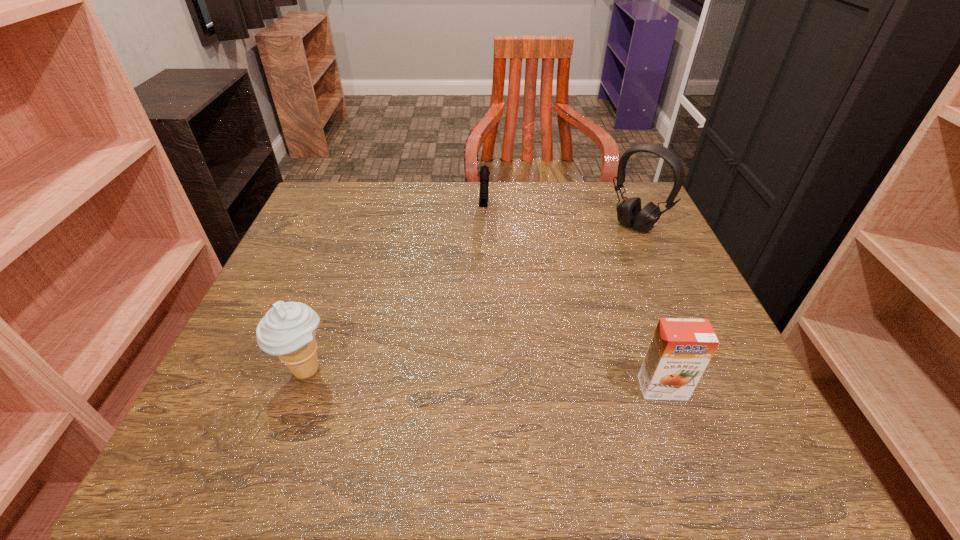
The width and height of the screenshot is (960, 540). I want to click on object that is positioned at the near left corner, so click(x=287, y=330).

In order to click on object that is at the far right corner in this screenshot , I will do `click(629, 213)`.

In order to click on object present at the near right corner in this screenshot , I will do `click(681, 348)`.

Find the location of `blank area at the far edge`. blank area at the far edge is located at coordinates (586, 228).

Image resolution: width=960 pixels, height=540 pixels. In the image, there is a desktop. In order to click on vacant space at the left edge in this screenshot , I will do `click(293, 240)`.

Image resolution: width=960 pixels, height=540 pixels. Identify the location of vacant space at the right edge of the desktop. [681, 267].

Image resolution: width=960 pixels, height=540 pixels. In order to click on vacant position at the far right corner of the desktop in this screenshot , I will do `click(613, 219)`.

At what (x,y) coordinates should I click in order to perform the action: click on vacant space at the near right corner of the desktop. Please return your answer as a coordinate pair (x, y). The image size is (960, 540). Looking at the image, I should click on (738, 391).

Locate an element on the screen. blank region between the icecream and the headset is located at coordinates (470, 298).

Find the location of a particular element. free spot between the icecream and the pistol is located at coordinates (396, 292).